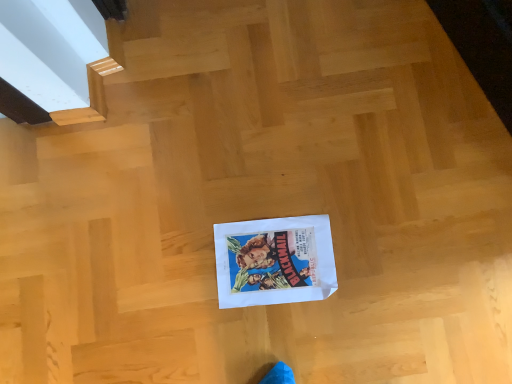
Where is `white paper flyer at center`? white paper flyer at center is located at coordinates (274, 261).

Describe the element at coordinates (274, 261) in the screenshot. I see `white paper flyer at center` at that location.

The width and height of the screenshot is (512, 384). Find the location of `white paper flyer at center`. white paper flyer at center is located at coordinates (274, 261).